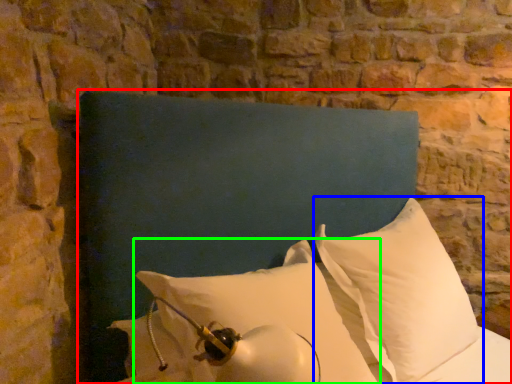
Question: Based on their relative distances, which object is farther from furniture (highlighted by a red box)? Choose from pillow (highlighted by a blue box) and pillow (highlighted by a green box).

Choices:
 (A) pillow
 (B) pillow

Answer: (A)